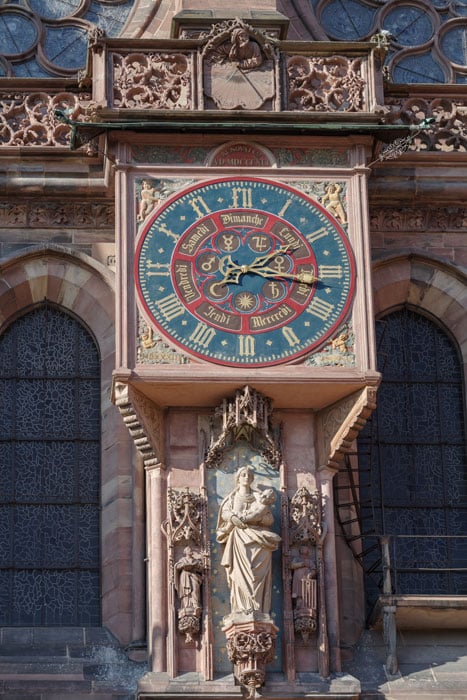
You are a GUI agent. You are given a task and a screenshot of the screen. Output one action in this format:
    pyautogui.click(x=<x>, y=<y>)
    Task: Click on the seat of bench
    The height and width of the screenshot is (700, 467).
    Given the screenshot: What is the action you would take?
    tap(415, 598)